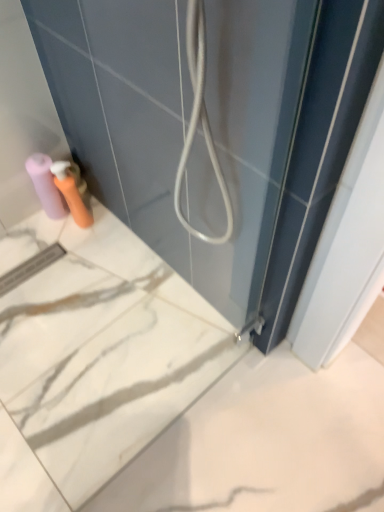
Question: Considering the positions of matte pink toilet paper at lower left and matte plastic soap dispenser at lower left in the image, is matte pink toilet paper at lower left taller or shorter than matte plastic soap dispenser at lower left?

Choices:
 (A) tall
 (B) short

Answer: (A)

Question: From the image's perspective, relative to matte plastic soap dispenser at lower left, is matte pink toilet paper at lower left above or below?

Choices:
 (A) below
 (B) above

Answer: (B)

Question: Looking at the image, does matte pink toilet paper at lower left seem bigger or smaller compared to matte plastic soap dispenser at lower left?

Choices:
 (A) small
 (B) big

Answer: (B)

Question: Considering their positions, is matte plastic soap dispenser at lower left located in front of or behind matte pink toilet paper at lower left?

Choices:
 (A) behind
 (B) front

Answer: (B)

Question: From the image's perspective, is matte plastic soap dispenser at lower left positioned above or below matte pink toilet paper at lower left?

Choices:
 (A) above
 (B) below

Answer: (B)

Question: From their relative heights in the image, would you say matte plastic soap dispenser at lower left is taller or shorter than matte pink toilet paper at lower left?

Choices:
 (A) tall
 (B) short

Answer: (B)

Question: Visually, is matte plastic soap dispenser at lower left positioned to the left or to the right of matte pink toilet paper at lower left?

Choices:
 (A) right
 (B) left

Answer: (A)